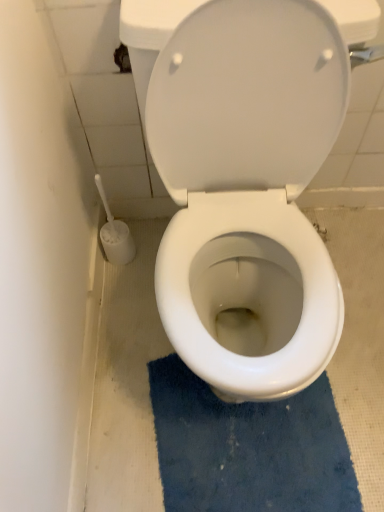
Question: Can you confirm if blue textured bath mat at center is thinner than white glossy toilet at center?

Choices:
 (A) no
 (B) yes

Answer: (B)

Question: Does blue textured bath mat at center appear on the right side of white glossy toilet at center?

Choices:
 (A) yes
 (B) no

Answer: (A)

Question: Is blue textured bath mat at center wider than white glossy toilet at center?

Choices:
 (A) no
 (B) yes

Answer: (A)

Question: Does blue textured bath mat at center appear on the left side of white glossy toilet at center?

Choices:
 (A) yes
 (B) no

Answer: (B)

Question: From a real-world perspective, is blue textured bath mat at center below white glossy toilet at center?

Choices:
 (A) yes
 (B) no

Answer: (A)

Question: Is blue textured bath mat at center not inside white glossy toilet at center?

Choices:
 (A) yes
 (B) no

Answer: (A)

Question: From a real-world perspective, is white glossy toilet at center located higher than blue textured bath mat at center?

Choices:
 (A) yes
 (B) no

Answer: (A)

Question: Is white glossy toilet at center located outside blue textured bath mat at center?

Choices:
 (A) no
 (B) yes

Answer: (B)

Question: Is white glossy toilet at center wider than blue textured bath mat at center?

Choices:
 (A) yes
 (B) no

Answer: (A)

Question: From the image's perspective, does white glossy toilet at center appear higher than blue textured bath mat at center?

Choices:
 (A) yes
 (B) no

Answer: (A)

Question: Is white glossy toilet at center beside blue textured bath mat at center?

Choices:
 (A) yes
 (B) no

Answer: (B)

Question: Is blue textured bath mat at center at the back of white glossy toilet at center?

Choices:
 (A) yes
 (B) no

Answer: (B)

Question: Is point (299, 109) closer or farther from the camera than point (329, 473)?

Choices:
 (A) farther
 (B) closer

Answer: (B)